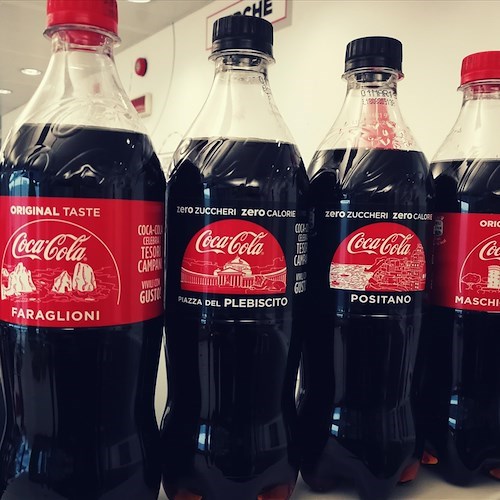
This screenshot has width=500, height=500. I want to click on bottles and lids, so click(x=76, y=15), click(x=81, y=174), click(x=237, y=35), click(x=250, y=145), click(x=384, y=60), click(x=383, y=173), click(x=474, y=65), click(x=471, y=176).